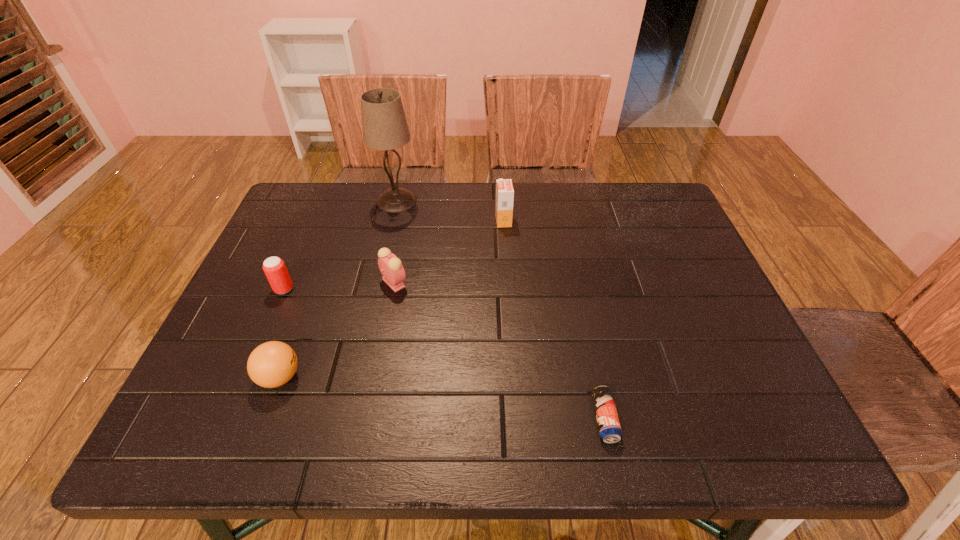
At what (x,y) coordinates should I click in order to perform the action: click on empty space between the fifth object from right to left and the farthest object. Please return your answer as a coordinate pair (x, y). The height and width of the screenshot is (540, 960). Looking at the image, I should click on (338, 289).

The width and height of the screenshot is (960, 540). Find the location of `free spot between the leftmost object and the lampshade`. free spot between the leftmost object and the lampshade is located at coordinates (340, 245).

Where is `vacant area that lies between the fifth shortest object and the shorter beer can`? The height and width of the screenshot is (540, 960). vacant area that lies between the fifth shortest object and the shorter beer can is located at coordinates (554, 320).

Where is `free area in between the farthest object and the alarm clock`? This screenshot has width=960, height=540. free area in between the farthest object and the alarm clock is located at coordinates (396, 242).

Locate an element on the screen. Image resolution: width=960 pixels, height=540 pixels. vacant area that lies between the second farthest object and the alarm clock is located at coordinates (449, 252).

The height and width of the screenshot is (540, 960). I want to click on unoccupied area between the fifth object from right to left and the rightmost object, so click(x=443, y=398).

Identify which object is the third nearest to the taller beer can. Please provide its 2D coordinates. Your answer should be formatted as a tuple, i.e. [(x, y)], where the tuple contains the x and y coordinates of a point satisfying the conditions above.

[(384, 123)]

Identify the location of the third closest object relative to the alarm clock. (384, 123).

Locate an element on the screen. Image resolution: width=960 pixels, height=540 pixels. vacant region that satisfies the following two spatial constraints: 1. on the face of the alarm clock; 2. on the front side of the taller beer can is located at coordinates point(393,289).

Where is `free region that satisfies the following two spatial constraints: 1. on the face of the shorter beer can; 2. on the left side of the alarm clock`? The image size is (960, 540). free region that satisfies the following two spatial constraints: 1. on the face of the shorter beer can; 2. on the left side of the alarm clock is located at coordinates (368, 418).